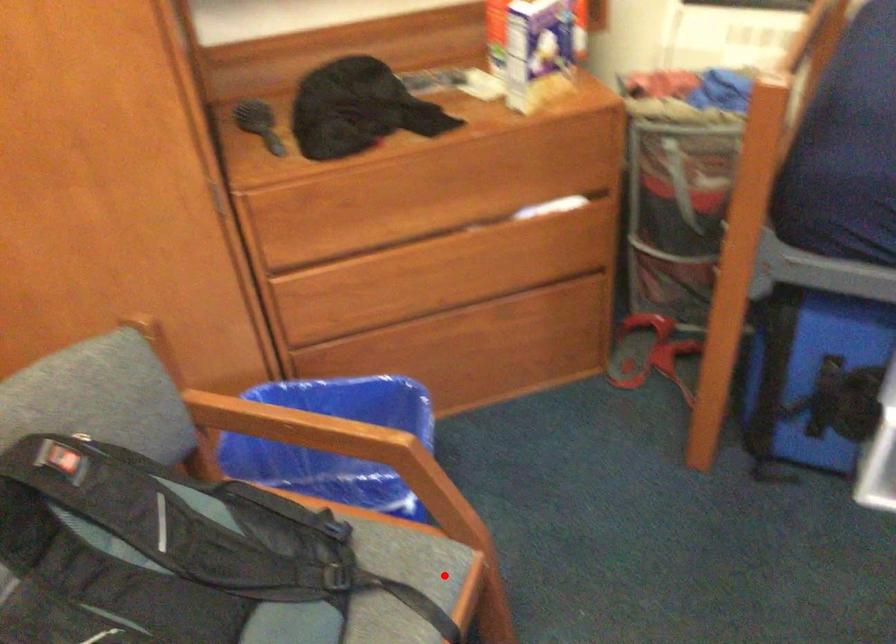
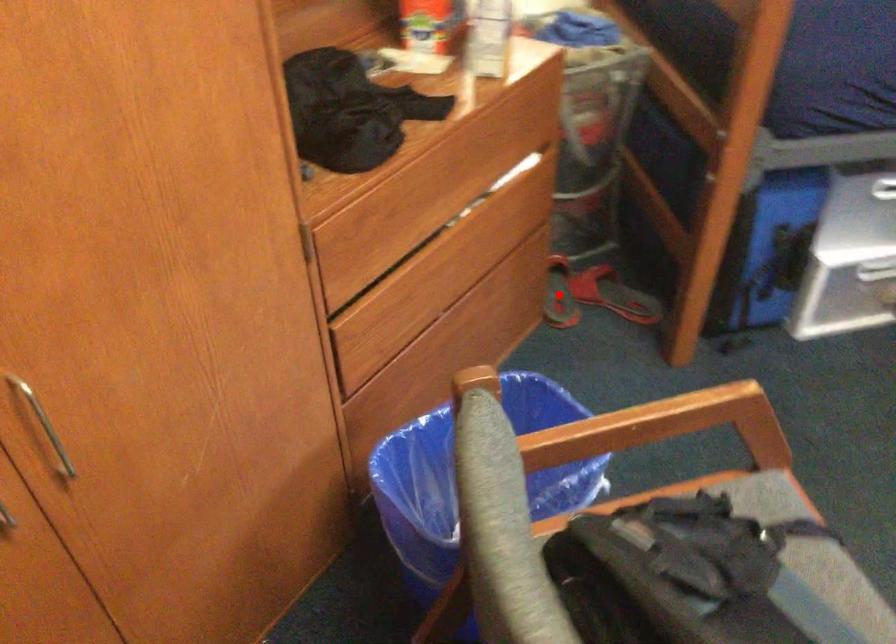
I am providing you with two images of the same scene from different viewpoints. A red point is marked on the first image and another point is marked on the second image. Are the points marked in image1 and image2 representing the same 3D position?

No